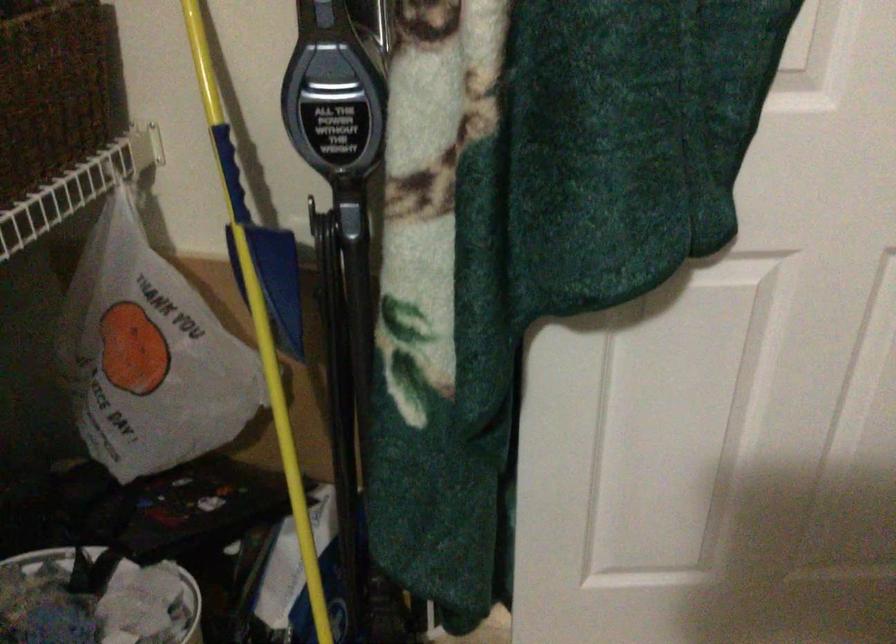
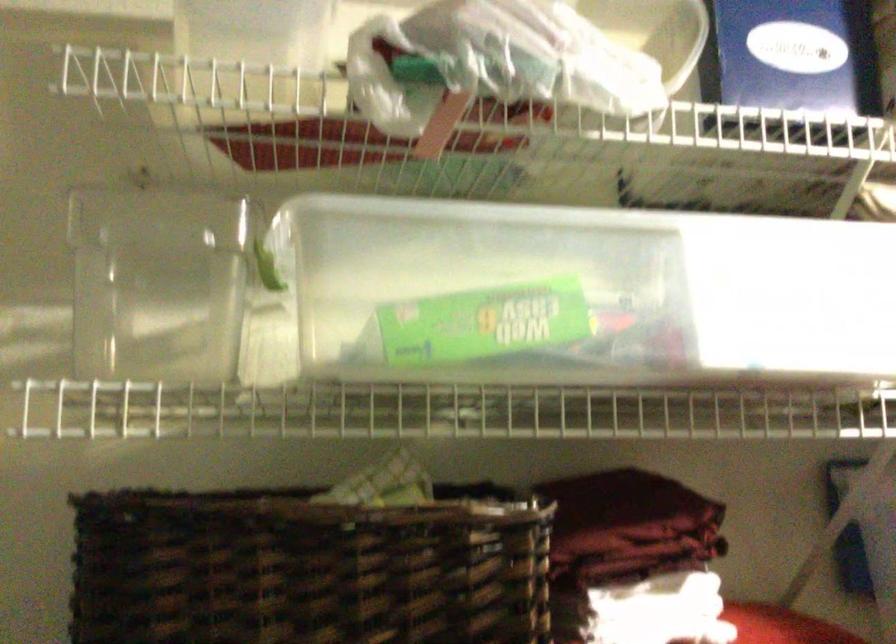
Question: The camera is either moving clockwise (left) or counter-clockwise (right) around the object. The first image is from the beginning of the video and the second image is from the end. Is the camera moving left or right when shooting the video?

Choices:
 (A) Left
 (B) Right

Answer: (A)